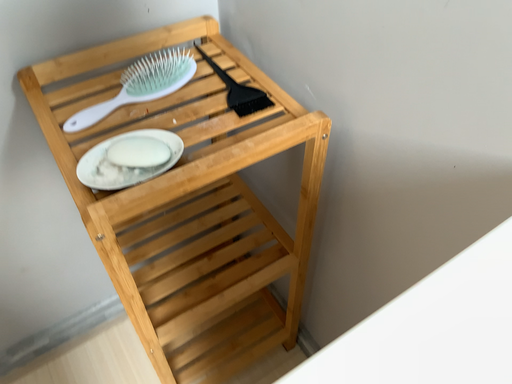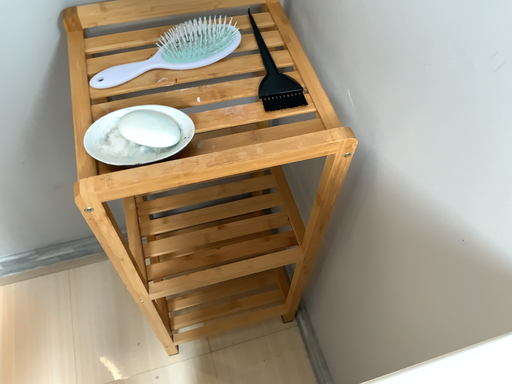
Question: How did the camera likely rotate when shooting the video?

Choices:
 (A) rotated left
 (B) rotated right

Answer: (A)